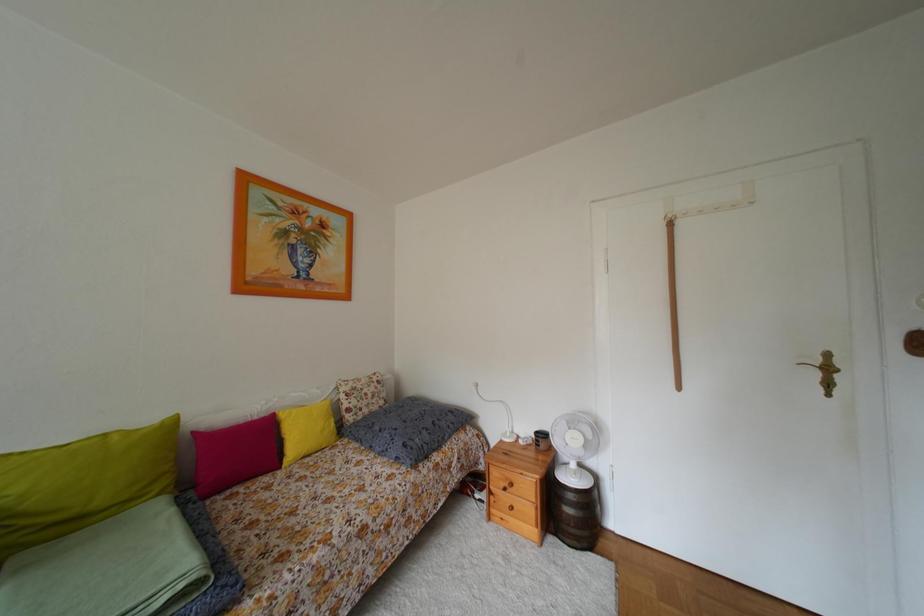
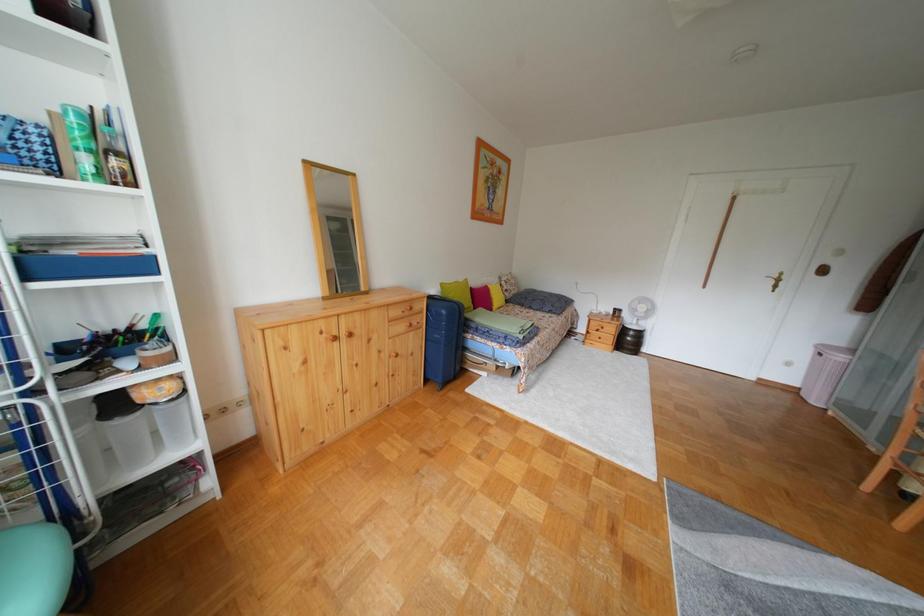
What movement of the cameraman would produce the second image?

The cameraman moved toward left, backward.